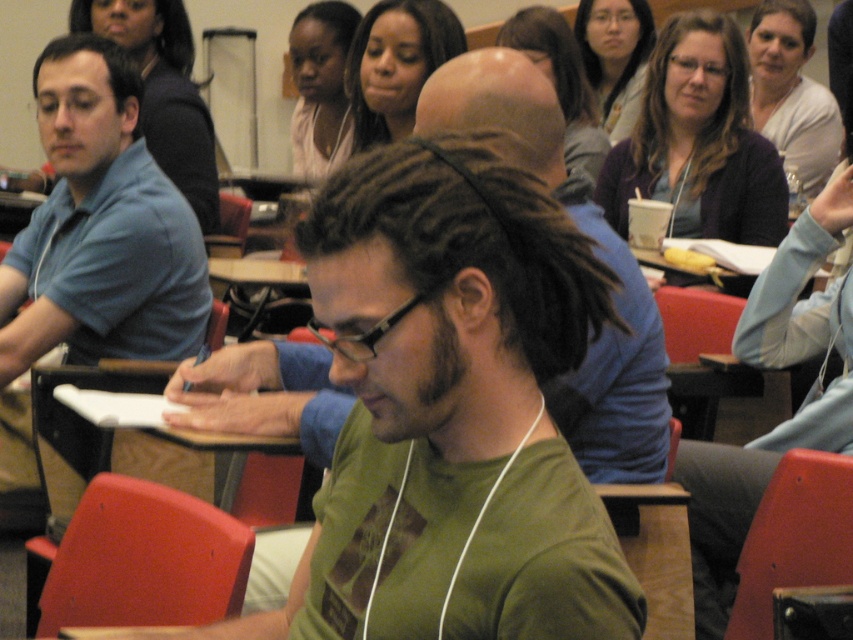
You are a student in the classroom and you want to describe the clothing and hair of the person at the front. Which one has a larger size between the matte black shirt at center and the matte black hair at upper center?

The matte black shirt at center has a larger size compared to the matte black hair at upper center.